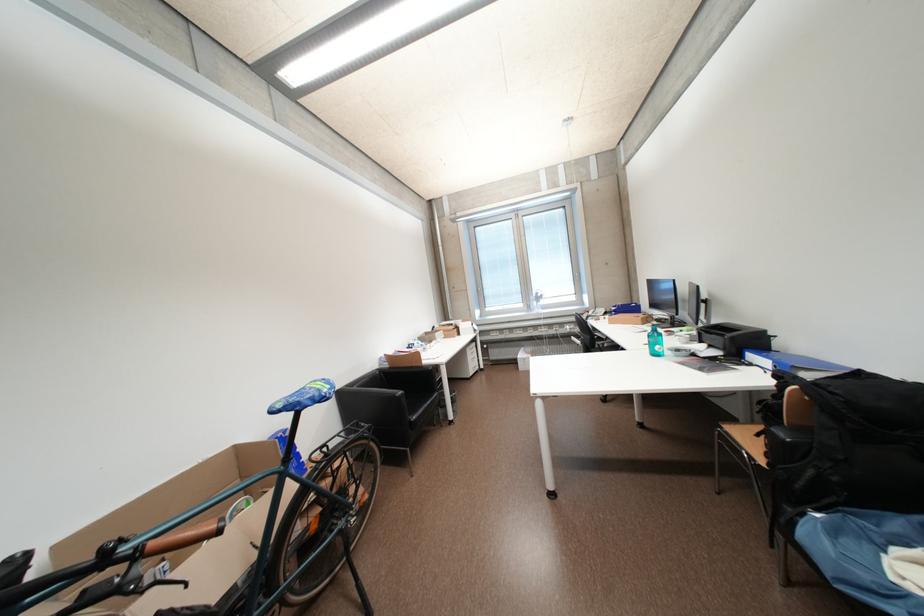
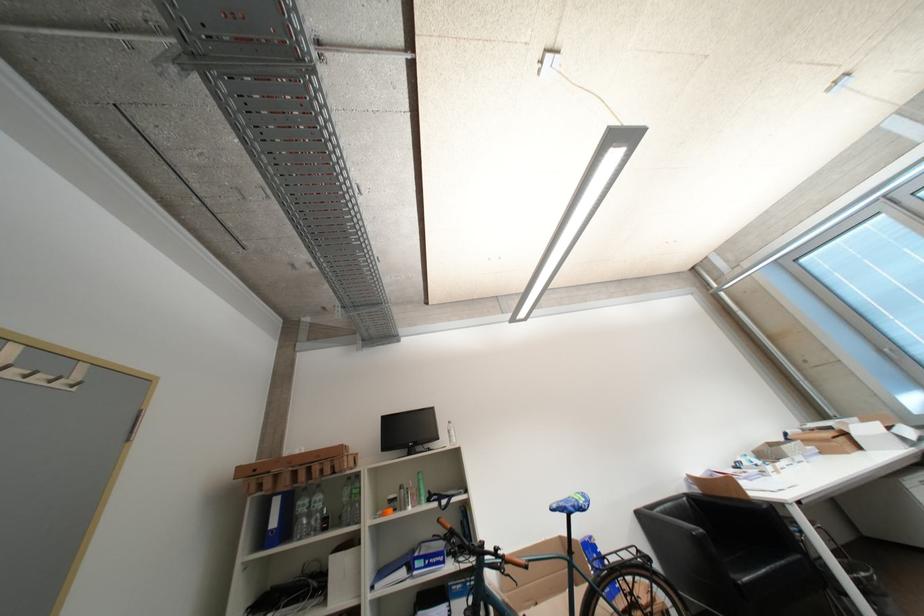
Based on the continuous images, in which direction is the camera rotating?

The camera's rotation is toward left-up.